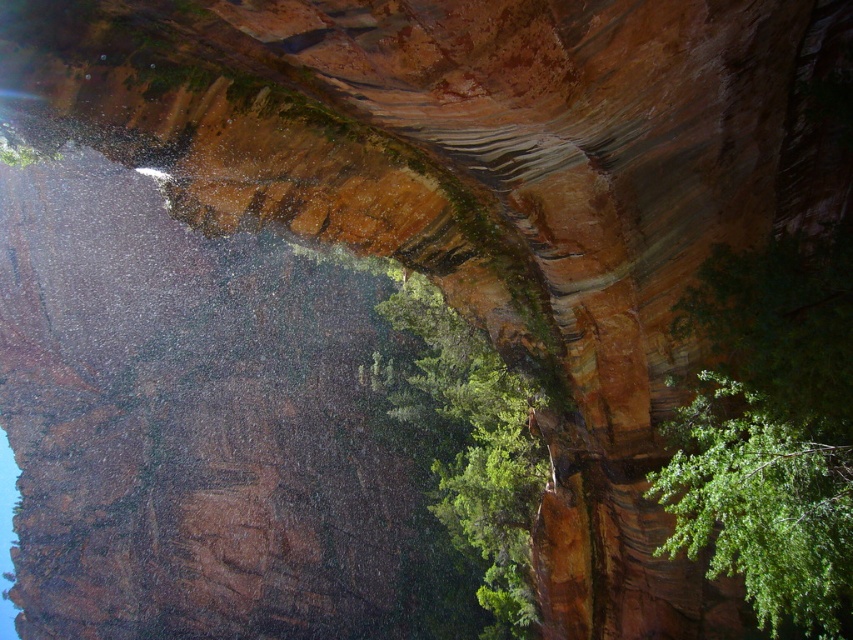
You are standing in front of the large rock formation and see the green leafy tree at right and the green leafy tree at center. Which tree is taller?

The green leafy tree at center is taller than the green leafy tree at right.

You are a hiker trying to decide which path to take next. You notice two green leafy trees in the scene. Which tree, the green leafy tree at right or the green leafy tree at center, is narrower?

The green leafy tree at right has a lesser width compared to the green leafy tree at center, so the green leafy tree at right is narrower.